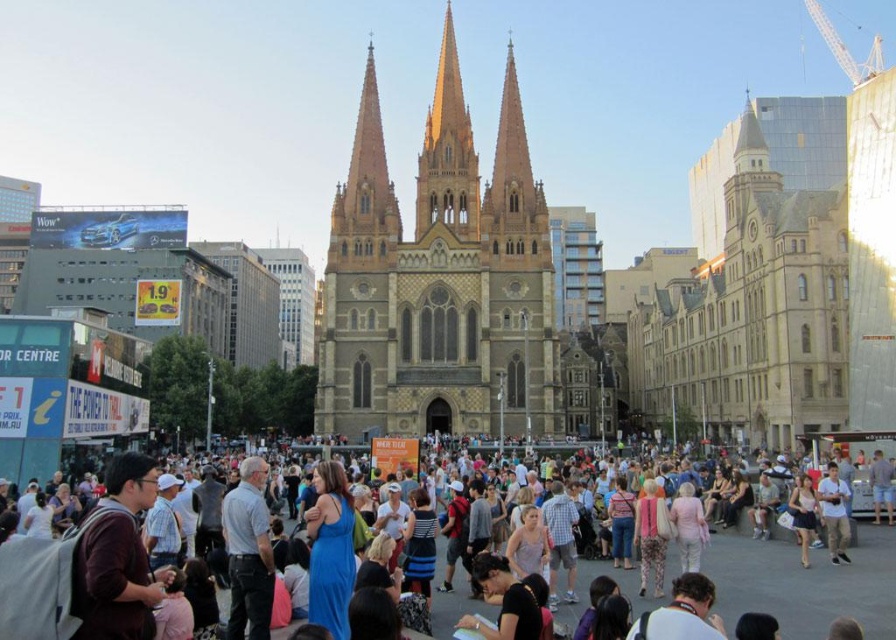
Consider the image. Between brown stone cathedral at center and light blue fabric shirt at center, which one appears on the right side from the viewer's perspective?

light blue fabric shirt at center is more to the right.

Is brown stone cathedral at center behind light blue fabric shirt at center?

Yes, it is behind light blue fabric shirt at center.

What do you see at coordinates (438, 280) in the screenshot? I see `brown stone cathedral at center` at bounding box center [438, 280].

Identify the location of brown stone cathedral at center. coord(438,280).

Can you confirm if brown stone cathedral at center is positioned above multicolored casual attire at center?

Yes, brown stone cathedral at center is above multicolored casual attire at center.

In the scene shown: How much distance is there between brown stone cathedral at center and multicolored casual attire at center?

40.38 meters

Identify the location of brown stone cathedral at center. Image resolution: width=896 pixels, height=640 pixels. (438, 280).

Between multicolored casual attire at center and light blue fabric shirt at center, which one appears on the right side from the viewer's perspective?

From the viewer's perspective, light blue fabric shirt at center appears more on the right side.

Does multicolored casual attire at center lie in front of light blue fabric shirt at center?

Yes.

Who is more distant from viewer, (869, 612) or (830, 513)?

The point (830, 513) is more distant.

Find the location of a particular element. The width and height of the screenshot is (896, 640). multicolored casual attire at center is located at coordinates (806, 580).